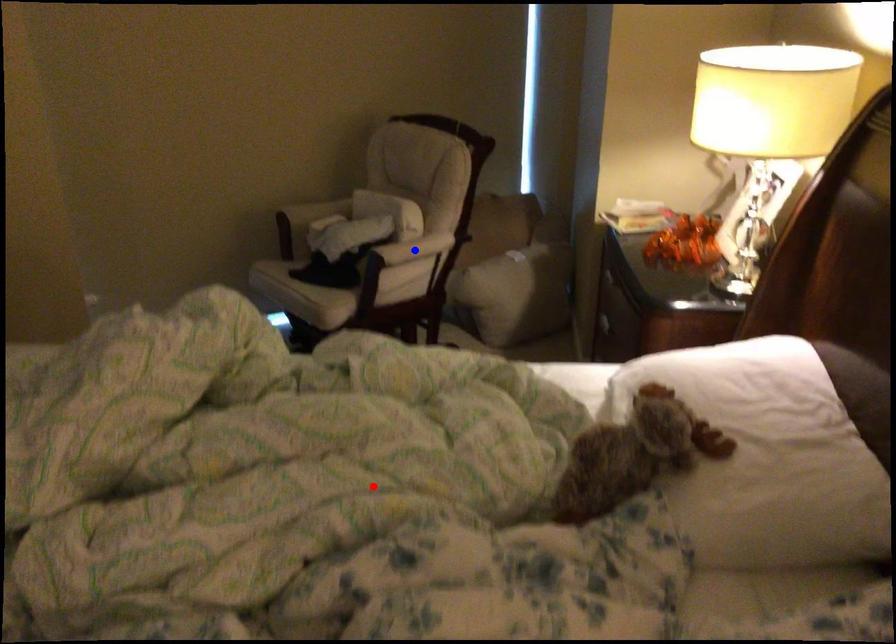
Question: Two points are marked on the image. Which point is closer to the camera?

Choices:
 (A) Blue point is closer.
 (B) Red point is closer.

Answer: (B)